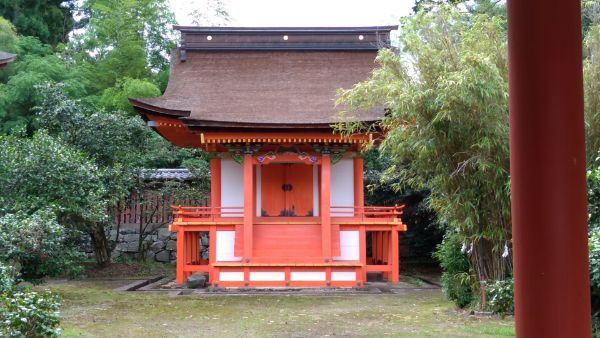
Locate an element on the screen. The height and width of the screenshot is (338, 600). door is located at coordinates (275, 185), (297, 187).